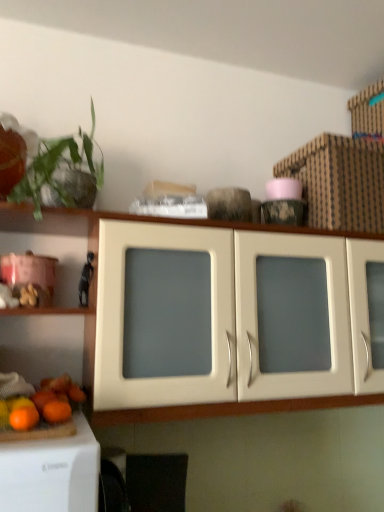
Measure the distance between point (55,408) and camera.

The distance of point (55,408) from camera is 37.48 inches.

In order to face matte white cabinet at center, should I rotate leftwards or rightwards?

You should look right and rotate roughly 7.248 degrees.

What is the approximate width of green leafy plant at upper left?

12.20 inches.

What are the coordinates of `black matte figurine at left` in the screenshot? It's located at (86, 280).

Identify the location of brown cardboard box at upper right. The width and height of the screenshot is (384, 512). (339, 182).

Describe the element at coordinates (339, 182) in the screenshot. I see `brown cardboard box at upper right` at that location.

The width and height of the screenshot is (384, 512). I want to click on orange matte at lower left, which is the 2th orange from front to back, so click(57, 411).

Can you confirm if brown cardboard box at upper right is bigger than matte white cabinet at center?

Actually, brown cardboard box at upper right might be smaller than matte white cabinet at center.

Does brown cardboard box at upper right contain matte white cabinet at center?

No.

From a real-world perspective, which object rests below the other?

matte white cabinet at center is physically lower.

What's the angular difference between brown cardboard box at upper right and matte white cabinet at center's facing directions?

The angle between the facing direction of brown cardboard box at upper right and the facing direction of matte white cabinet at center is 1.4 degrees.

What's the angular difference between green leafy plant at upper left and matte white cabinet at center's facing directions?

There is a 1.44-degree angle between the facing directions of green leafy plant at upper left and matte white cabinet at center.

Between point (94, 186) and point (145, 417), which one is positioned in front?

Positioned in front is point (94, 186).

Which of these two, green leafy plant at upper left or matte white cabinet at center, stands taller?

matte white cabinet at center is taller.

Does green leafy plant at upper left turn towards matte white cabinet at center?

No, green leafy plant at upper left does not turn towards matte white cabinet at center.

Which is behind, point (357, 178) or point (11, 413)?

The point (357, 178) is farther.

From the image's perspective, which one is positioned higher, brown cardboard box at upper right or orange matte at lower left, arranged as the first orange when viewed from the front?

brown cardboard box at upper right, from the image's perspective.

From a real-world perspective, who is located higher, brown cardboard box at upper right or orange matte at lower left, the 2th orange positioned from the back?

brown cardboard box at upper right is physically above.

Who is bigger, brown cardboard box at upper right or orange matte at lower left, arranged as the first orange when viewed from the front?

brown cardboard box at upper right.

At what (x,y) coordinates should I click in order to perform the action: click on cabinetry that appears below the green leafy plant at upper left (from the image's perspective). Please return your answer as a coordinate pair (x, y). The width and height of the screenshot is (384, 512). Looking at the image, I should click on (229, 409).

Is green leafy plant at upper left a part of matte white cabinet at center?

No.

Is matte white cabinet at center taller or shorter than green leafy plant at upper left?

Clearly, matte white cabinet at center is taller compared to green leafy plant at upper left.

Is matte white cabinet at center looking in the opposite direction of green leafy plant at upper left?

matte white cabinet at center is not turned away from green leafy plant at upper left.

Relative to black matte figurine at left, is orange matte at lower left, the 2th orange positioned from the back, in front or behind?

In the image, orange matte at lower left, the 2th orange positioned from the back, appears in front of black matte figurine at left.

Does point (21, 423) come closer to viewer compared to point (85, 273)?

Yes, point (21, 423) is closer to viewer.

How distant is orange matte at lower left, arranged as the first orange when viewed from the front, from black matte figurine at left?

The distance of orange matte at lower left, arranged as the first orange when viewed from the front, from black matte figurine at left is 18.03 inches.

Locate an element on the screen. The height and width of the screenshot is (512, 384). orange that is the 2nd one when counting forward from the black matte figurine at left is located at coordinates point(24,418).

Is green leafy plant at upper left at the right side of brown cardboard box at upper right?

No, green leafy plant at upper left is not to the right of brown cardboard box at upper right.

Considering the sizes of objects green leafy plant at upper left and brown cardboard box at upper right in the image provided, who is thinner, green leafy plant at upper left or brown cardboard box at upper right?

Thinner between the two is green leafy plant at upper left.

Between green leafy plant at upper left and brown cardboard box at upper right, which one has less height?

brown cardboard box at upper right.

Considering the positions of objects green leafy plant at upper left and brown cardboard box at upper right in the image provided, who is in front, green leafy plant at upper left or brown cardboard box at upper right?

green leafy plant at upper left.

Considering the positions of objects matte white cabinet at center and brown cardboard box at upper right in the image provided, who is in front, matte white cabinet at center or brown cardboard box at upper right?

matte white cabinet at center.

Is point (91, 212) positioned before point (345, 219)?

That is True.

Is matte white cabinet at center placed right next to brown cardboard box at upper right?

No.

Considering the sizes of matte white cabinet at center and brown cardboard box at upper right in the image, is matte white cabinet at center taller or shorter than brown cardboard box at upper right?

Clearly, matte white cabinet at center is taller compared to brown cardboard box at upper right.

The height and width of the screenshot is (512, 384). In order to click on cardboard box behind the matte white cabinet at center in this screenshot , I will do `click(339, 182)`.

Locate an element on the screen. This screenshot has width=384, height=512. plant in front of the matte white cabinet at center is located at coordinates (62, 173).

From the image, which object appears to be farther from brown cardboard box at upper right, orange matte at lower left, arranged as the 1th orange when viewed from the back, or matte white cabinet at center?

orange matte at lower left, arranged as the 1th orange when viewed from the back.

Looking at this image, looking at the image, which one is located closer to orange matte at lower left, arranged as the 1th orange when viewed from the back, brown cardboard box at upper right or black matte figurine at left?

Based on the image, black matte figurine at left appears to be nearer to orange matte at lower left, arranged as the 1th orange when viewed from the back.

From the image, which object appears to be farther from brown cardboard box at upper right, orange matte at lower left, the 2th orange positioned from the back, or black matte figurine at left?

Based on the image, orange matte at lower left, the 2th orange positioned from the back, appears to be further to brown cardboard box at upper right.

Which object lies nearer to the anchor point orange matte at lower left, which is the 2th orange from front to back, brown cardboard box at upper right or orange matte at lower left, arranged as the first orange when viewed from the front?

orange matte at lower left, arranged as the first orange when viewed from the front, is positioned closer to the anchor orange matte at lower left, which is the 2th orange from front to back.

Looking at the image, which one is located further to orange matte at lower left, arranged as the 1th orange when viewed from the back, matte white cabinet at center or orange matte at lower left, arranged as the first orange when viewed from the front?

Among the two, matte white cabinet at center is located further to orange matte at lower left, arranged as the 1th orange when viewed from the back.

From the image, which object appears to be farther from orange matte at lower left, which is the 2th orange from front to back, green leafy plant at upper left or black matte figurine at left?

green leafy plant at upper left is positioned further to the anchor orange matte at lower left, which is the 2th orange from front to back.

Which object lies nearer to the anchor point orange matte at lower left, arranged as the 1th orange when viewed from the back, orange matte at lower left, arranged as the first orange when viewed from the front, or green leafy plant at upper left?

orange matte at lower left, arranged as the first orange when viewed from the front, is positioned closer to the anchor orange matte at lower left, arranged as the 1th orange when viewed from the back.

Considering their positions, is matte white cabinet at center positioned further to black matte figurine at left than green leafy plant at upper left?

matte white cabinet at center lies further to black matte figurine at left than the other object.

I want to click on toy between green leafy plant at upper left and matte white cabinet at center from left to right, so click(x=86, y=280).

I want to click on cabinetry situated between green leafy plant at upper left and brown cardboard box at upper right from left to right, so click(229, 409).

This screenshot has height=512, width=384. I want to click on toy between green leafy plant at upper left and brown cardboard box at upper right from left to right, so click(86, 280).

Where is `toy between orange matte at lower left, the 2th orange positioned from the back, and matte white cabinet at center from left to right`? The image size is (384, 512). toy between orange matte at lower left, the 2th orange positioned from the back, and matte white cabinet at center from left to right is located at coordinates (86, 280).